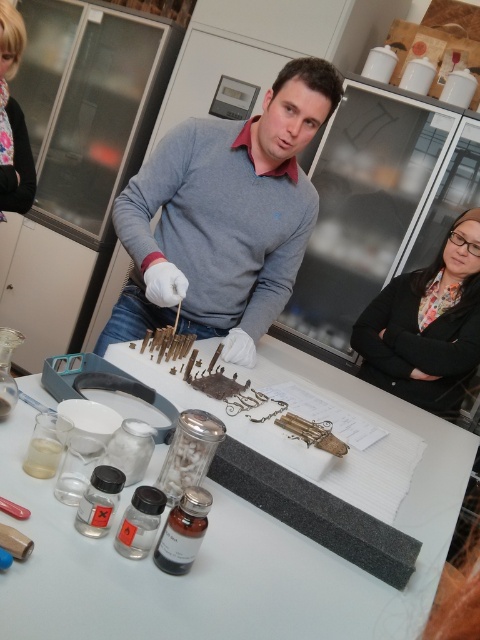
You are a GUI agent. You are given a task and a screenshot of the screen. Output one action in this format:
    pyautogui.click(x=<x>, y=<y>)
    Task: Click on the black matte table at center
    The height and width of the screenshot is (640, 480).
    Given the screenshot: What is the action you would take?
    pyautogui.click(x=235, y=552)

Is black matte table at center positioned at the back of floral fabric shirt at upper left?

No, black matte table at center is in front of floral fabric shirt at upper left.

Who is more distant from viewer, (300, 355) or (11, 29)?

Point (300, 355)

Where is `black matte table at center`? The image size is (480, 640). black matte table at center is located at coordinates (235, 552).

This screenshot has height=640, width=480. Describe the element at coordinates (223, 218) in the screenshot. I see `matte gray sweater at center` at that location.

Find the location of a particular element. matte gray sweater at center is located at coordinates (223, 218).

Who is more distant from viewer, (153, 618) or (468, 328)?

The point (468, 328) is more distant.

Does black matte table at center come in front of black fabric at center?

Yes, black matte table at center is in front of black fabric at center.

Who is more forward, [254,563] or [451,417]?

Point [254,563]

At what (x,y) coordinates should I click in order to perform the action: click on black matte table at center. Please return your answer as a coordinate pair (x, y). Image resolution: width=480 pixels, height=640 pixels. Looking at the image, I should click on (235, 552).